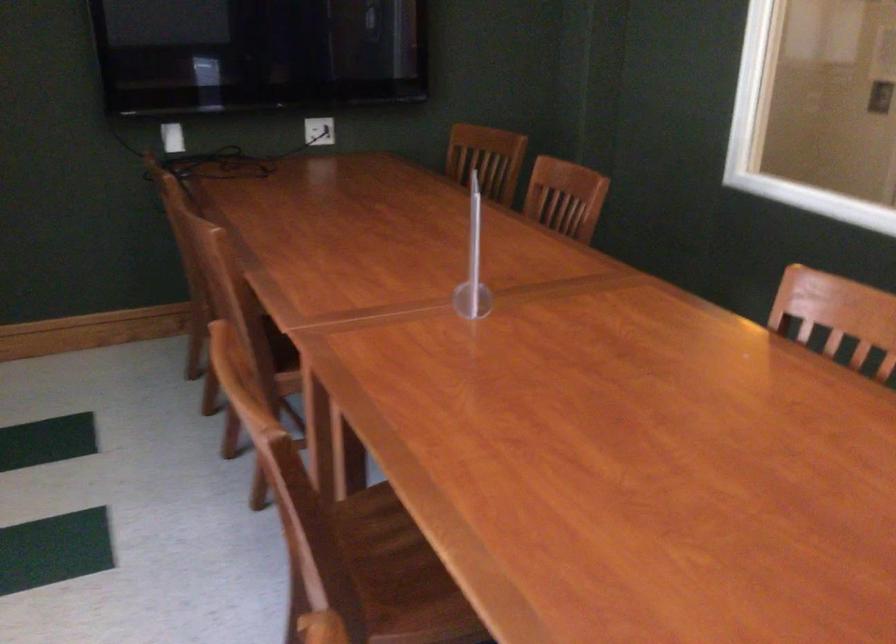
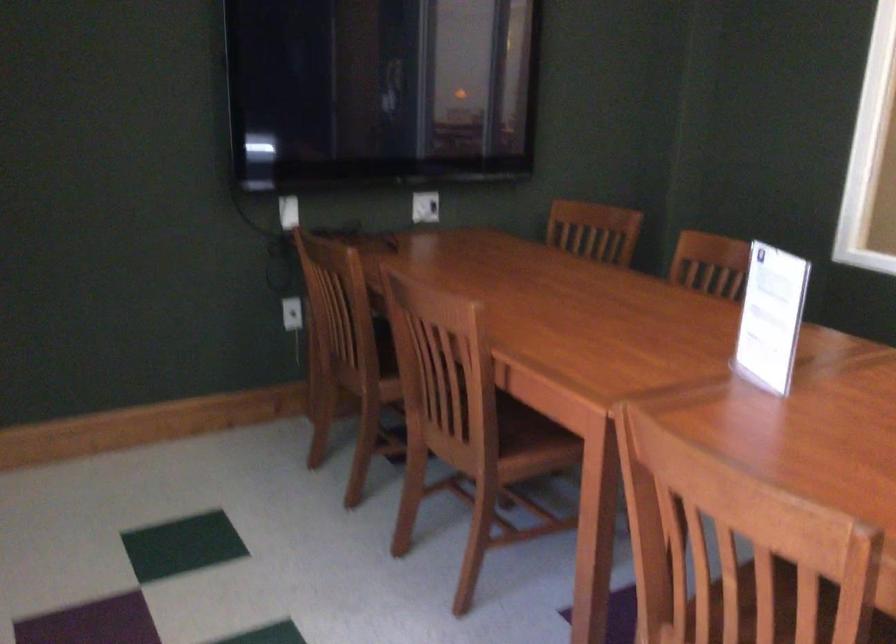
Question: What movement of the cameraman would produce the second image?

Choices:
 (A) Left
 (B) Right
 (C) Forward
 (D) Backward

Answer: (A)